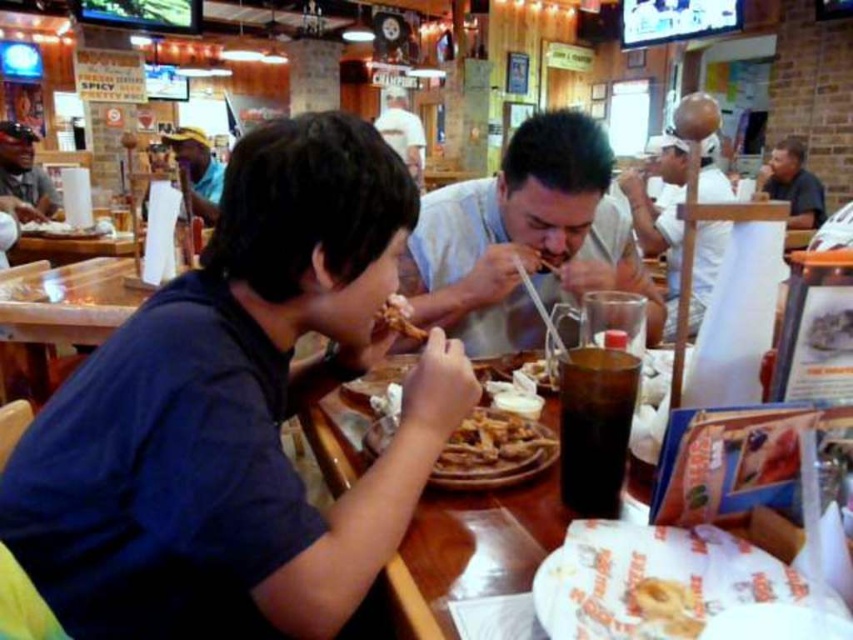
Question: Which object is the closest to the wooden table at center?

Choices:
 (A) white paper napkin at center
 (B) golden crispy donut at center

Answer: (B)

Question: Which object is positioned farthest from the white matte bowl at upper center?

Choices:
 (A) white paper hat at upper center
 (B) brown crispy chicken at center
 (C) wooden table at center

Answer: (A)

Question: Does dark gray shirt at upper right come behind white paper hat at upper center?

Choices:
 (A) yes
 (B) no

Answer: (B)

Question: Can you confirm if dark gray shirt at upper right is bigger than white paper hat at upper center?

Choices:
 (A) yes
 (B) no

Answer: (A)

Question: Which object is the closest to the wooden table at center?

Choices:
 (A) brushed metal water at bottle left
 (B) dark gray shirt at upper right
 (C) blue denim shirt at upper left

Answer: (C)

Question: Is blue denim shirt at upper left positioned at the back of golden crispy donut at center?

Choices:
 (A) no
 (B) yes

Answer: (B)